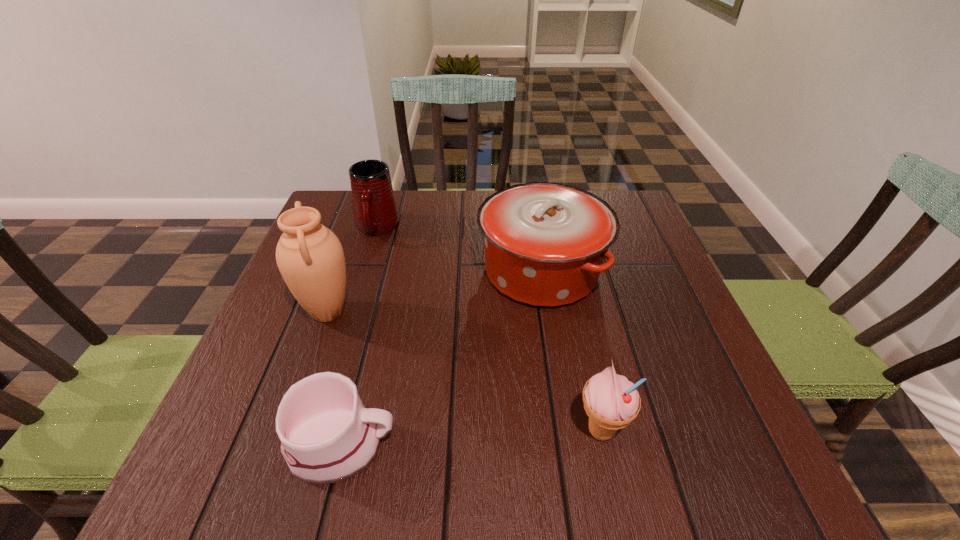
The height and width of the screenshot is (540, 960). Identify the location of free space at the far edge. (432, 202).

Find the location of a particular element. This screenshot has width=960, height=540. vacant space at the near edge of the desktop is located at coordinates (545, 465).

Identify the location of free location at the left edge. The image size is (960, 540). (265, 386).

At what (x,y) coordinates should I click in order to perform the action: click on free spot at the right edge of the desktop. Please return your answer as a coordinate pair (x, y). The image size is (960, 540). Looking at the image, I should click on (645, 318).

In the image, there is a desktop. Where is `free space at the near right corner`? The height and width of the screenshot is (540, 960). free space at the near right corner is located at coordinates (697, 451).

This screenshot has height=540, width=960. In order to click on free point between the icecream and the casserole in this screenshot , I will do `click(571, 352)`.

Where is `unoccupied position between the nearer mug and the icecream`? The height and width of the screenshot is (540, 960). unoccupied position between the nearer mug and the icecream is located at coordinates (470, 438).

Find the location of a particular element. free spot between the casserole and the taller mug is located at coordinates (459, 250).

Locate an element on the screen. This screenshot has width=960, height=540. unoccupied position between the casserole and the icecream is located at coordinates (571, 352).

The image size is (960, 540). Find the location of `vacant point located between the casserole and the taller mug`. vacant point located between the casserole and the taller mug is located at coordinates (459, 250).